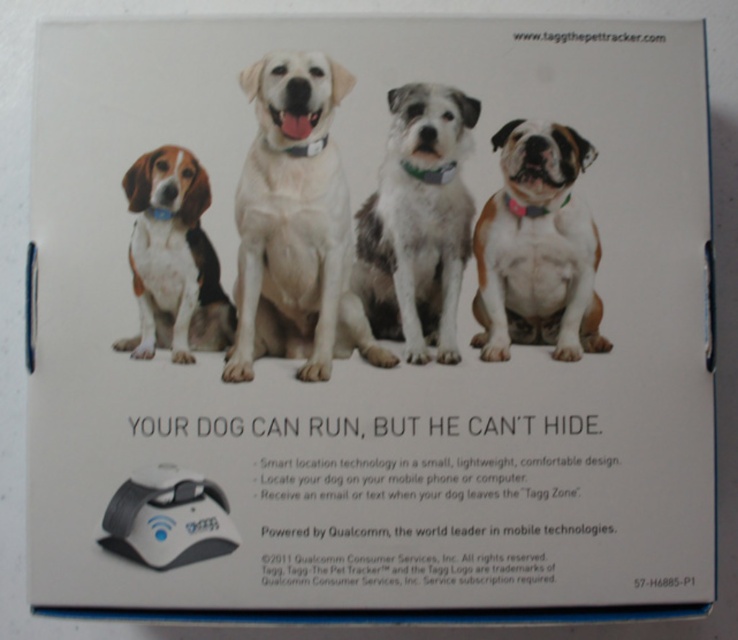
Question: Which object is the farthest from the tri-color fur beagle at left?

Choices:
 (A) white plastic mouse at bottom left
 (B) pink fabric dog at right
 (C) white matte dog at center

Answer: (B)

Question: In this image, where is white fur dog at center located relative to white plastic mouse at bottom left?

Choices:
 (A) below
 (B) above

Answer: (B)

Question: Does pink fabric dog at right have a smaller size compared to white plastic mouse at bottom left?

Choices:
 (A) yes
 (B) no

Answer: (B)

Question: Which object is the closest to the tri-color fur beagle at left?

Choices:
 (A) white matte dog at center
 (B) white plastic mouse at bottom left
 (C) white fur dog at center
 (D) pink fabric dog at right

Answer: (A)

Question: Is white matte dog at center smaller than tri-color fur beagle at left?

Choices:
 (A) no
 (B) yes

Answer: (A)

Question: Which of the following is the closest to the observer?

Choices:
 (A) white fur dog at center
 (B) pink fabric dog at right

Answer: (B)